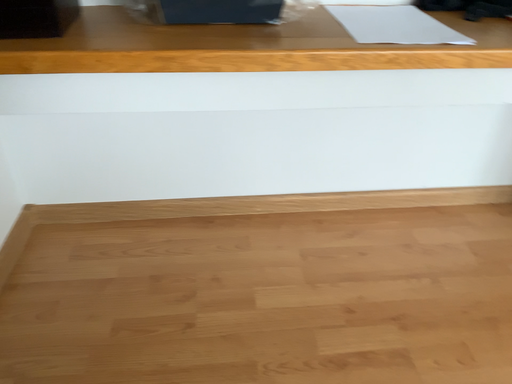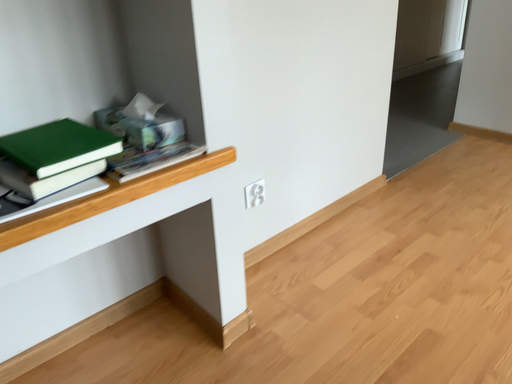
Question: How did the camera likely rotate when shooting the video?

Choices:
 (A) rotated left
 (B) rotated right

Answer: (B)